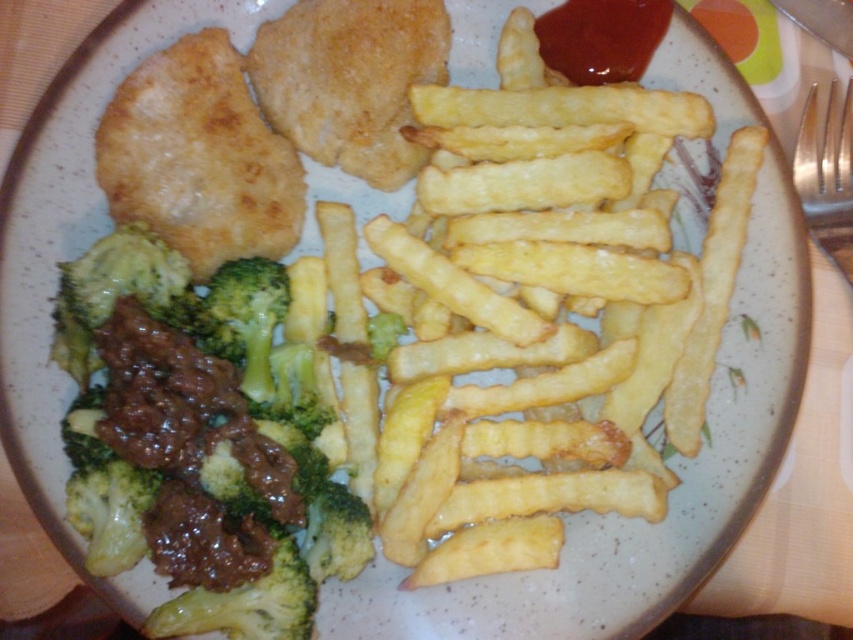
How distant is green matte broccoli at lower left from green matte broccoli at center-left?

10.57 centimeters

Does green matte broccoli at lower left have a larger size compared to green matte broccoli at center-left?

Indeed, green matte broccoli at lower left has a larger size compared to green matte broccoli at center-left.

Locate an element on the screen. The width and height of the screenshot is (853, 640). green matte broccoli at lower left is located at coordinates (200, 440).

Is point (541, 40) more distant than point (271, 339)?

Yes, it is.

Which is behind, point (601, 65) or point (262, 300)?

Positioned behind is point (601, 65).

Where is `shiny red sauce at top right`? This screenshot has width=853, height=640. shiny red sauce at top right is located at coordinates (x=601, y=38).

Who is more distant from viewer, (241, 433) or (625, 72)?

The point (625, 72) is behind.

Which of these two, green matte broccoli at lower left or shiny red sauce at top right, stands shorter?

Standing shorter between the two is shiny red sauce at top right.

Is point (276, 508) farther from camera compared to point (639, 60)?

That is False.

Where is `green matte broccoli at lower left`? green matte broccoli at lower left is located at coordinates (200, 440).